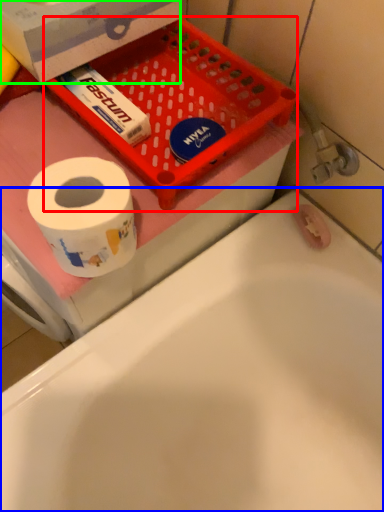
Question: Which is nearer to the basket (highlighted by a red box)? bathtub (highlighted by a blue box) or box (highlighted by a green box).

Choices:
 (A) bathtub
 (B) box

Answer: (B)